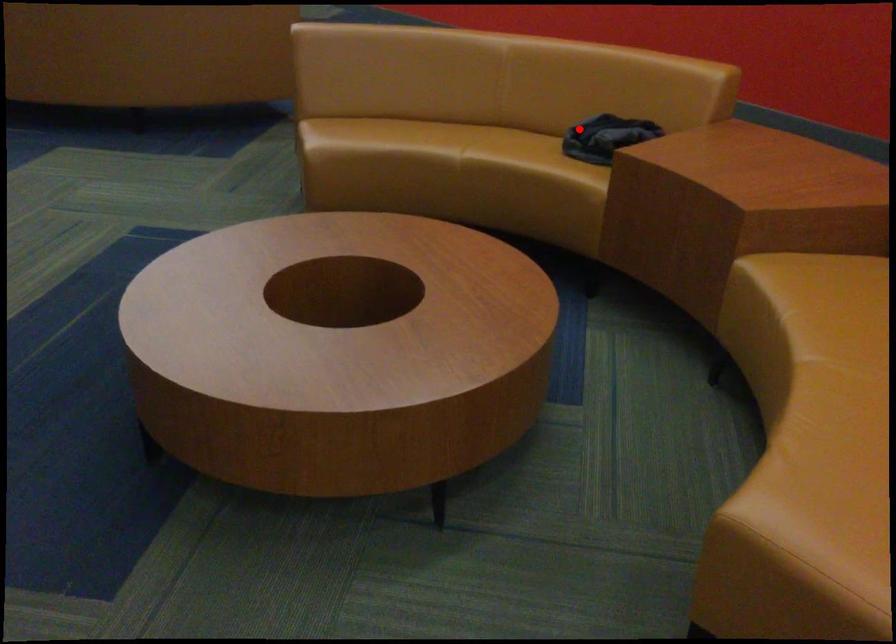
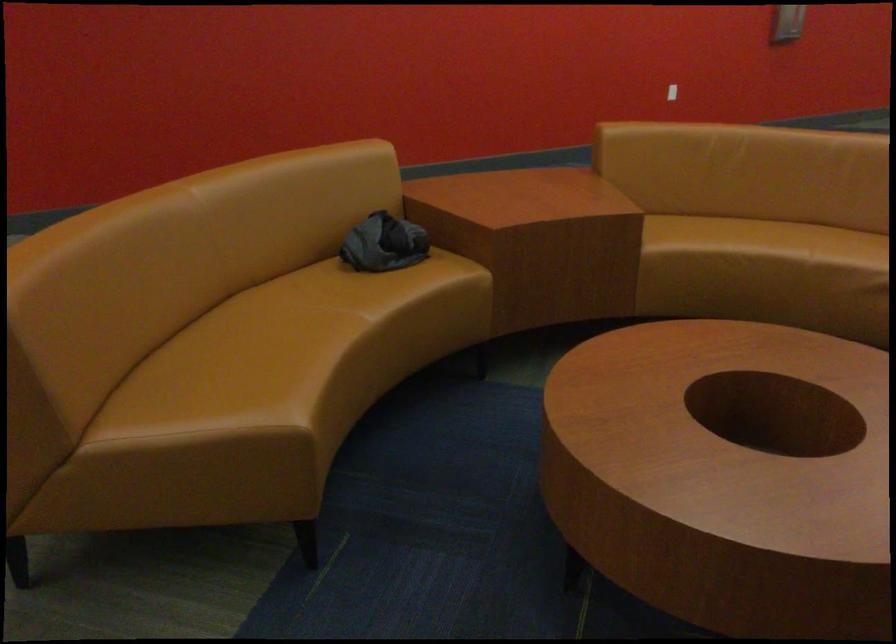
Find the pixel in the second image that matches the highlighted location in the first image.

(383, 243)